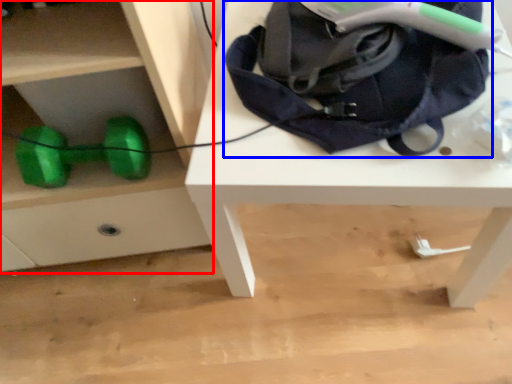
Question: Which of the following is the farthest to the observer, chest of drawers (highlighted by a red box) or bag (highlighted by a blue box)?

Choices:
 (A) chest of drawers
 (B) bag

Answer: (B)